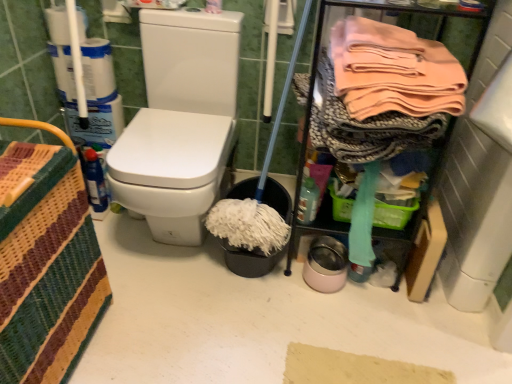
Question: Does woven fabric basket at left touch white matte toilet paper at upper left?

Choices:
 (A) yes
 (B) no

Answer: (B)

Question: From a real-world perspective, does woven fabric basket at left stand above white matte toilet paper at upper left?

Choices:
 (A) yes
 (B) no

Answer: (B)

Question: Considering the relative sizes of woven fabric basket at left and white matte toilet paper at upper left in the image provided, is woven fabric basket at left bigger than white matte toilet paper at upper left?

Choices:
 (A) yes
 (B) no

Answer: (A)

Question: From the image's perspective, is woven fabric basket at left beneath white matte toilet paper at upper left?

Choices:
 (A) no
 (B) yes

Answer: (B)

Question: Is woven fabric basket at left smaller than white matte toilet paper at upper left?

Choices:
 (A) yes
 (B) no

Answer: (B)

Question: Is woven fabric basket at left at the left side of white matte toilet paper at upper left?

Choices:
 (A) yes
 (B) no

Answer: (B)

Question: Considering the relative sizes of pink fabric at upper right and translucent plastic bottle at lower right in the image provided, is pink fabric at upper right wider than translucent plastic bottle at lower right?

Choices:
 (A) yes
 (B) no

Answer: (A)

Question: From the image's perspective, is pink fabric at upper right below translucent plastic bottle at lower right?

Choices:
 (A) no
 (B) yes

Answer: (A)

Question: Can you confirm if pink fabric at upper right is positioned to the left of translucent plastic bottle at lower right?

Choices:
 (A) no
 (B) yes

Answer: (A)

Question: From a real-world perspective, is pink fabric at upper right located beneath translucent plastic bottle at lower right?

Choices:
 (A) yes
 (B) no

Answer: (B)

Question: From the image's perspective, is pink fabric at upper right over translucent plastic bottle at lower right?

Choices:
 (A) no
 (B) yes

Answer: (B)

Question: Can you see pink fabric at upper right touching translucent plastic bottle at lower right?

Choices:
 (A) yes
 (B) no

Answer: (B)

Question: Is translucent plastic bottle at lower right far away from pink fabric at upper right?

Choices:
 (A) no
 (B) yes

Answer: (A)